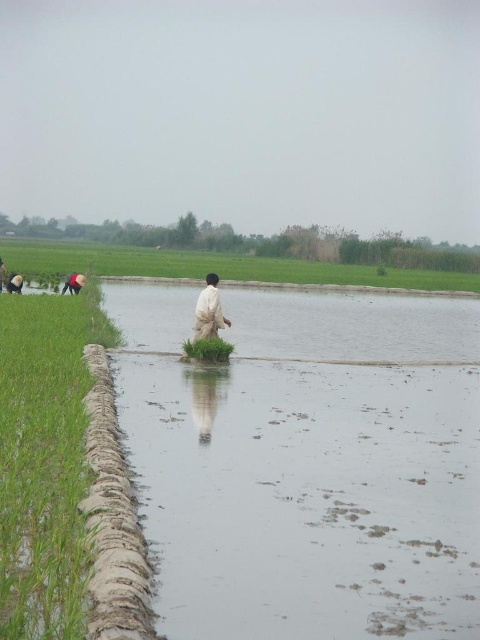
Based on the photo, you are a photographer standing at the edge of the rice paddy field. You want to capture a photo that includes both the white cotton shirt at center and the matte black person at lower left. Based on their positions, which object is closer to the camera?

The matte black person at lower left is closer to the camera since they are positioned at lower left, which is typically nearer in such scenes compared to the center area.

You are standing in the rice paddy field and want to cross to the other side. You see the green grass at left and the muddy dirt trench at left. Which path should you choose to avoid sinking into the mud?

You should choose the green grass at left because it is closer to the viewer and less likely to have deep mud compared to the muddy dirt trench at left which is further away and more prone to sinking.

You are standing in a rural area and see a muddy dirt trench at left. If you want to cross to the other side, what is the minimum width of the bridge you need to build?

The muddy dirt trench at left is 5.07 meters away from you, so the bridge must be at least 5.07 meters long to safely cross over it.